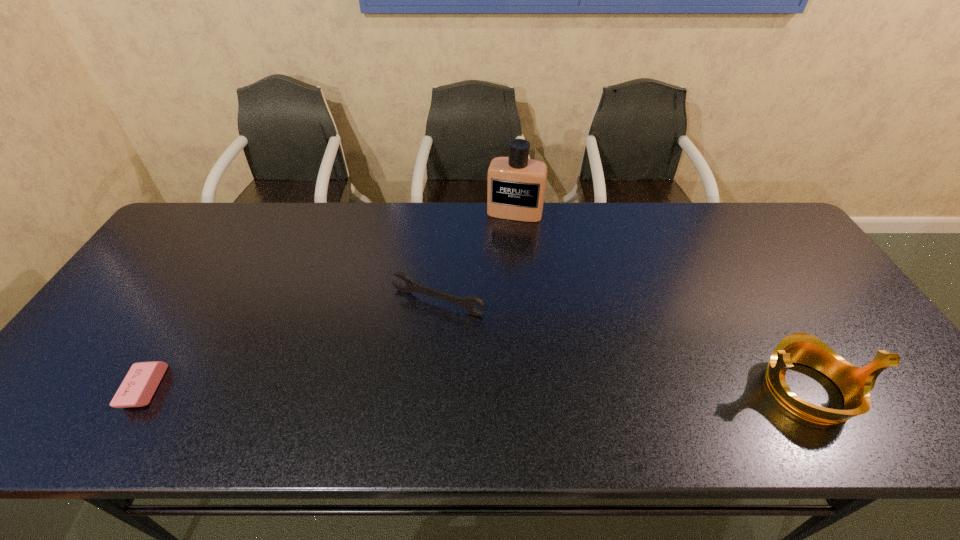
This screenshot has height=540, width=960. Identify the location of the shortest object. (138, 387).

Where is `the leftmost object`? the leftmost object is located at coordinates coord(138,387).

The height and width of the screenshot is (540, 960). In order to click on the second tallest object in this screenshot , I will do `click(855, 383)`.

At what (x,y) coordinates should I click in order to perform the action: click on the rightmost object. Please return your answer as a coordinate pair (x, y). The width and height of the screenshot is (960, 540). Looking at the image, I should click on (855, 383).

Locate an element on the screen. This screenshot has height=540, width=960. the third object from right to left is located at coordinates (467, 303).

The height and width of the screenshot is (540, 960). I want to click on the third tallest object, so click(467, 303).

Where is `the farthest object`? This screenshot has height=540, width=960. the farthest object is located at coordinates (516, 185).

This screenshot has width=960, height=540. Find the location of `the tallest object`. the tallest object is located at coordinates (516, 185).

Where is `vacant space located on the left of the shortest object`? vacant space located on the left of the shortest object is located at coordinates (109, 389).

Locate an element on the screen. This screenshot has height=540, width=960. vacant space located at the front emblem of the rightmost object is located at coordinates (900, 390).